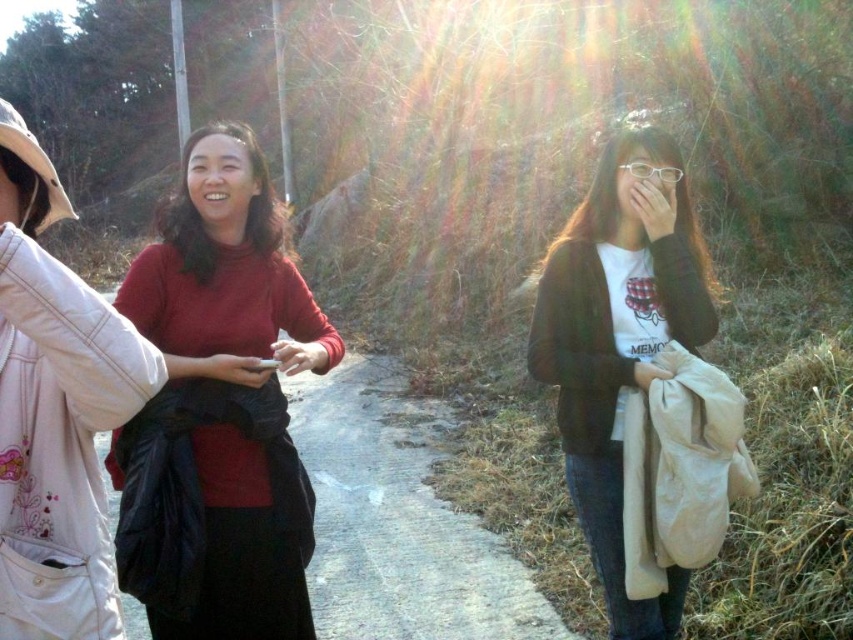
Where is the matte red sweater at center located in the image?

The matte red sweater at center is located at point (219, 408).

Where is the matte red sweater at center located in the image?

The matte red sweater at center is located at point (x=219, y=408).

You are standing at the center of the image and want to place a new object at the same location as the black fabric bag at center. What coordinates should you use?

The coordinates for the black fabric bag at center are (398, 518).